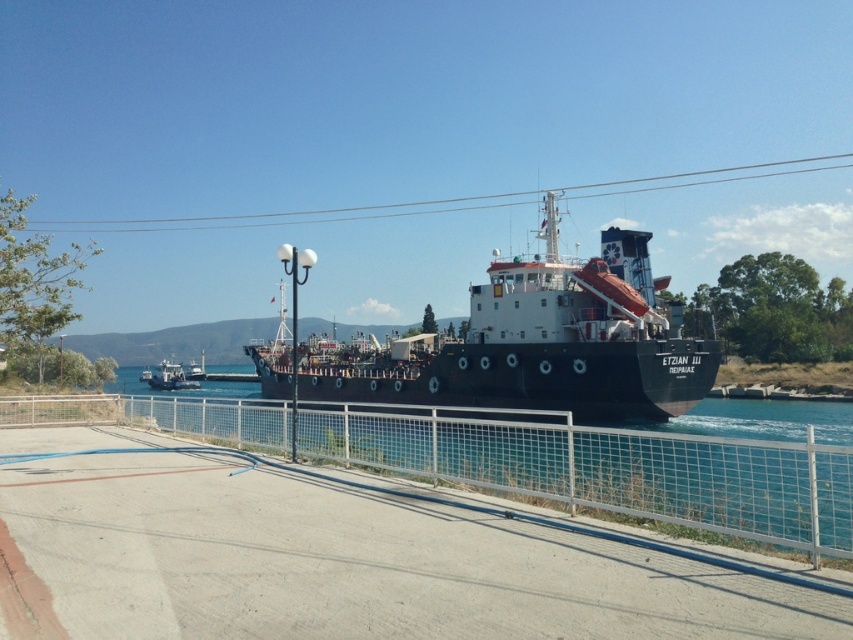
Is metal mesh fence at center positioned before black matte ship at center?

That is True.

Is metal mesh fence at center wider than black matte ship at center?

No, metal mesh fence at center is not wider than black matte ship at center.

This screenshot has width=853, height=640. What are the coordinates of `metal mesh fence at center` in the screenshot? It's located at (606, 467).

Identify the location of metal mesh fence at center. This screenshot has height=640, width=853. (606, 467).

Is point (585, 304) closer to camera compared to point (196, 385)?

Yes, it is in front of point (196, 385).

Is point (538, 326) farther from viewer compared to point (184, 387)?

No, it is in front of (184, 387).

At what (x,y) coordinates should I click in order to perform the action: click on black matte ship at center. Please return your answer as a coordinate pair (x, y). The height and width of the screenshot is (640, 853). Looking at the image, I should click on (524, 344).

Measure the distance between metal mesh fence at center and camera.

They are 5.81 meters apart.

Where is `metal mesh fence at center`? metal mesh fence at center is located at coordinates (606, 467).

Where is `metal mesh fence at center`? metal mesh fence at center is located at coordinates (606, 467).